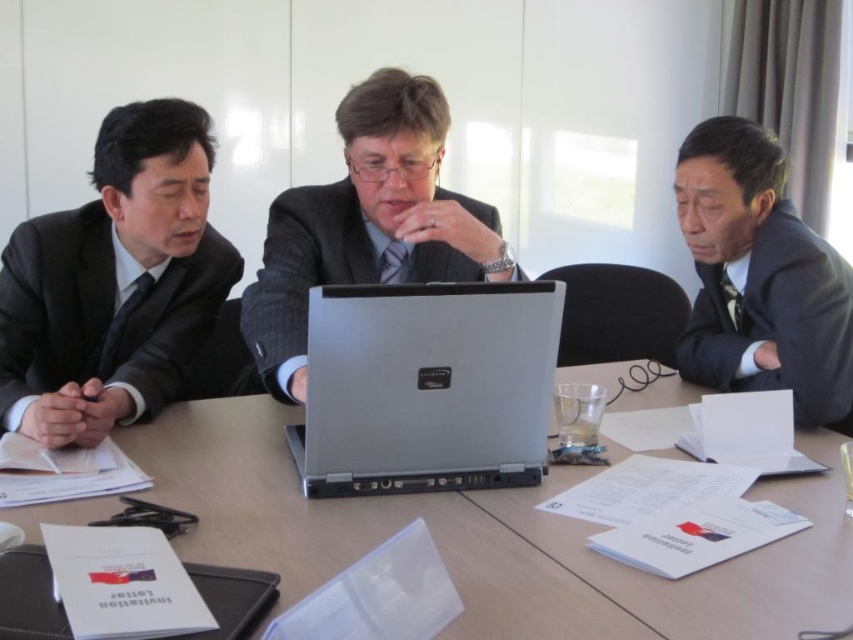
You are a photographer standing behind the table. You need to position a microphone so it can capture both the dark gray matte suit at left and the dark gray suit at right clearly. Which side of the table should you place the microphone to ensure it can reach both individuals?

The dark gray matte suit at left is not as tall as dark gray suit at right, so placing the microphone on the side of the table closer to the dark gray matte suit at left would allow it to capture both individuals effectively, as the taller person on the right will still be within range.

In the scene shown: You are standing in front of the meeting table and want to place a 1.5 meter long banner between the central figure and the point at coordinates point (27, 392). Will the banner fit without overlapping any objects?

The distance between the central figure and point (27, 392) is not provided, so we cannot determine if the banner will fit. However, the point (27, 392) is 1.46 meters away from the viewer, but the banner length is 1.5 meters. This might be close, but without knowing the exact distance between the two points, it is uncertain.

Based on the scene description, if you were standing behind the wooden table at center, which side would the silver metallic laptop at center be on relative to your position?

The silver metallic laptop at center is to the left of the wooden table at center. Since the wooden table at center is to the right of the silver metallic laptop at center, when standing behind the wooden table at center, the laptop would be positioned to your left side.